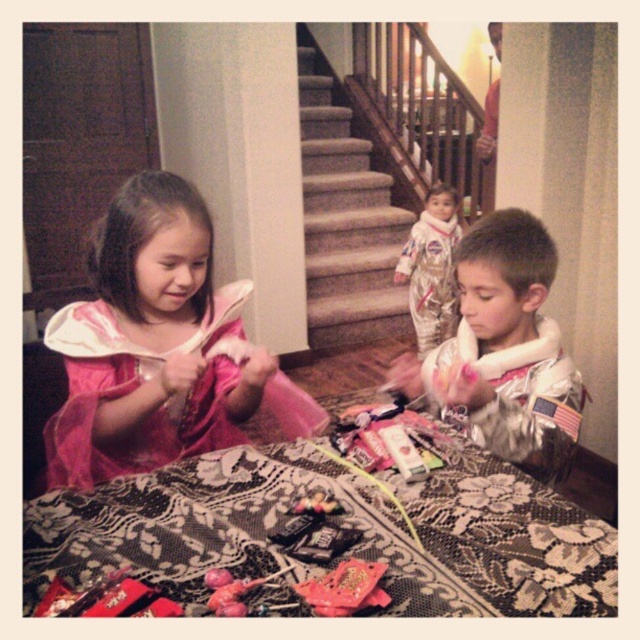
Between silver metallic astronaut suit at center and shiny metallic toy at center, which one is positioned lower?

shiny metallic toy at center is below.

Can you confirm if silver metallic astronaut suit at center is positioned below shiny metallic toy at center?

No.

Is point (524, 417) positioned in front of point (356, 598)?

No, it is behind (356, 598).

At what (x,y) coordinates should I click in order to perform the action: click on silver metallic astronaut suit at center. Please return your answer as a coordinate pair (x, y). Looking at the image, I should click on (504, 349).

Can you confirm if carpeted stairs at center is positioned to the left of metallic pink toy at center?

Incorrect, carpeted stairs at center is not on the left side of metallic pink toy at center.

The width and height of the screenshot is (640, 640). What do you see at coordinates (346, 216) in the screenshot?
I see `carpeted stairs at center` at bounding box center [346, 216].

Does point (369, 292) come behind point (310, 499)?

Yes, it is behind point (310, 499).

Find the location of `carpeted stairs at center`. carpeted stairs at center is located at coordinates (346, 216).

This screenshot has width=640, height=640. What are the coordinates of `pink satin dress at center` in the screenshot? It's located at (157, 346).

Measure the distance between pink satin dress at center and carpeted stairs at center.

pink satin dress at center and carpeted stairs at center are 8.71 feet apart from each other.

Between point (125, 211) and point (323, 321), which one is positioned behind?

The point (323, 321) is more distant.

Locate an element on the screen. pink satin dress at center is located at coordinates (157, 346).